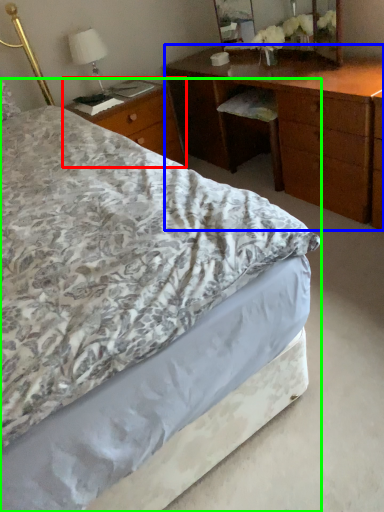
Question: Based on their relative distances, which object is farther from nightstand (highlighted by a red box)? Choose from desk (highlighted by a blue box) and bed (highlighted by a green box).

Choices:
 (A) desk
 (B) bed

Answer: (B)